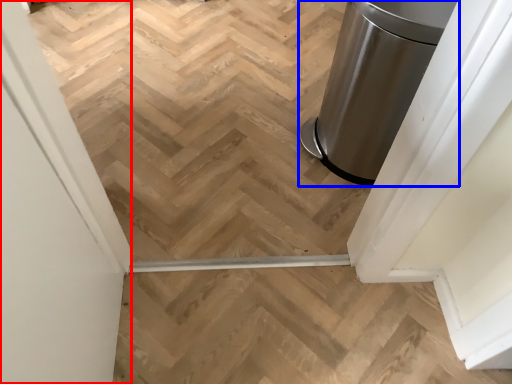
Question: Which object is further to the camera taking this photo, screen door (highlighted by a red box) or waste container (highlighted by a blue box)?

Choices:
 (A) screen door
 (B) waste container

Answer: (B)